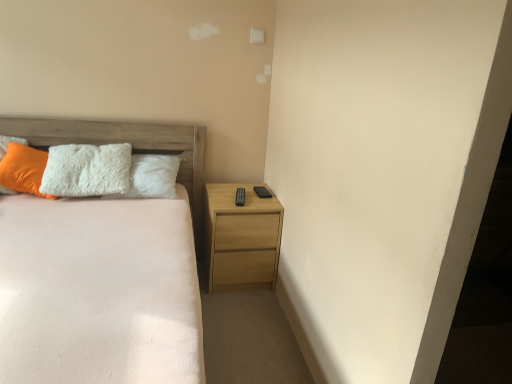
Where is `white fluffy bed at center`? The width and height of the screenshot is (512, 384). white fluffy bed at center is located at coordinates (106, 271).

This screenshot has width=512, height=384. What do you see at coordinates (242, 238) in the screenshot? I see `light wood/texture nightstand at right` at bounding box center [242, 238].

At what (x,y) coordinates should I click in order to perform the action: click on wooden headboard at upper left. Please return your answer as a coordinate pair (x, y). The image size is (512, 384). Looking at the image, I should click on (123, 142).

Which object is thinner, light wood/texture nightstand at right or wooden headboard at upper left?

Thinner between the two is wooden headboard at upper left.

What's the angular difference between light wood/texture nightstand at right and wooden headboard at upper left's facing directions?

light wood/texture nightstand at right and wooden headboard at upper left are facing 1.94 degrees away from each other.

Based on the photo, which is closer to the camera, (x=257, y=211) or (x=198, y=133)?

Point (x=257, y=211) is positioned closer to the camera compared to point (x=198, y=133).

Is light wood/texture nightstand at right facing away from wooden headboard at upper left?

That's not correct — light wood/texture nightstand at right is not looking away from wooden headboard at upper left.

Measure the distance between white fluffy bed at center and wooden headboard at upper left.

white fluffy bed at center is 30.61 inches away from wooden headboard at upper left.

Is white fluffy bed at center inside or outside of wooden headboard at upper left?

white fluffy bed at center is located beyond the bounds of wooden headboard at upper left.

Does white fluffy bed at center have a lesser width compared to wooden headboard at upper left?

In fact, white fluffy bed at center might be wider than wooden headboard at upper left.

Does point (148, 375) come behind point (2, 131)?

No, (148, 375) is closer to viewer.

From the image's perspective, is light wood/texture nightstand at right positioned above or below white fluffy bed at center?

light wood/texture nightstand at right is above white fluffy bed at center.

Looking at the image, does light wood/texture nightstand at right seem bigger or smaller compared to white fluffy bed at center?

In the image, light wood/texture nightstand at right appears to be smaller than white fluffy bed at center.

Considering the relative sizes of light wood/texture nightstand at right and white fluffy bed at center in the image provided, is light wood/texture nightstand at right thinner than white fluffy bed at center?

Yes, light wood/texture nightstand at right is thinner than white fluffy bed at center.

Does point (275, 272) lie behind point (13, 353)?

Yes, point (275, 272) is farther from viewer.

Does orange fuzzy pillow at left touch light wood/texture nightstand at right?

No, orange fuzzy pillow at left is not touching light wood/texture nightstand at right.

From the image's perspective, which one is positioned lower, orange fuzzy pillow at left or light wood/texture nightstand at right?

light wood/texture nightstand at right.

From a real-world perspective, which object stands above the other?

From a 3D spatial view, orange fuzzy pillow at left is above.

Which is in front, orange fuzzy pillow at left or white fluffy bed at center?

white fluffy bed at center is more forward.

Is orange fuzzy pillow at left to the right of white fluffy bed at center from the viewer's perspective?

No, orange fuzzy pillow at left is not to the right of white fluffy bed at center.

Between orange fuzzy pillow at left and white fluffy bed at center, which one has smaller width?

With smaller width is orange fuzzy pillow at left.

From the image's perspective, who appears lower, orange fuzzy pillow at left or white fluffy bed at center?

white fluffy bed at center.

Is orange fuzzy pillow at left at the back of white fluffy bed at center?

Yes, white fluffy bed at center is positioned with its back facing orange fuzzy pillow at left.

Based on the photo, between white fluffy bed at center and orange fuzzy pillow at left, which one has less height?

orange fuzzy pillow at left is shorter.

In the image, is white fluffy bed at center positioned in front of or behind orange fuzzy pillow at left?

Visually, white fluffy bed at center is located in front of orange fuzzy pillow at left.

In the scene shown: Which point is more distant from viewer, (128,308) or (13,148)?

Positioned behind is point (13,148).

Is orange fuzzy pillow at left facing away from wooden headboard at upper left?

No, orange fuzzy pillow at left is not facing away from wooden headboard at upper left.

Considering the relative sizes of orange fuzzy pillow at left and wooden headboard at upper left in the image provided, is orange fuzzy pillow at left taller than wooden headboard at upper left?

No.

From the image's perspective, is orange fuzzy pillow at left on top of wooden headboard at upper left?

Yes, from the image's perspective, orange fuzzy pillow at left is above wooden headboard at upper left.

Is orange fuzzy pillow at left bigger or smaller than wooden headboard at upper left?

Clearly, orange fuzzy pillow at left is smaller in size than wooden headboard at upper left.

At what (x,y) coordinates should I click in order to perform the action: click on nightstand below the wooden headboard at upper left (from the image's perspective). Please return your answer as a coordinate pair (x, y). Image resolution: width=512 pixels, height=384 pixels. Looking at the image, I should click on (242, 238).

You are a GUI agent. You are given a task and a screenshot of the screen. Output one action in this format:
    pyautogui.click(x=<x>, y=<y>)
    Task: Click on the headboard on the left of the white fluffy bed at center
    The image size is (512, 384).
    Given the screenshot: What is the action you would take?
    pyautogui.click(x=123, y=142)

Looking at the image, which one is located closer to light wood/texture nightstand at right, white fluffy bed at center or orange fuzzy pillow at left?

white fluffy bed at center is closer to light wood/texture nightstand at right.

Based on their spatial positions, is wooden headboard at upper left or white fluffy bed at center closer to light wood/texture nightstand at right?

Based on the image, wooden headboard at upper left appears to be nearer to light wood/texture nightstand at right.

Considering their positions, is light wood/texture nightstand at right positioned closer to wooden headboard at upper left than white fluffy bed at center?

light wood/texture nightstand at right lies closer to wooden headboard at upper left than the other object.

When comparing their distances from orange fuzzy pillow at left, does white fluffy bed at center or light wood/texture nightstand at right seem closer?

white fluffy bed at center.

Considering their positions, is white fluffy bed at center positioned closer to light wood/texture nightstand at right than wooden headboard at upper left?

wooden headboard at upper left.

Which object lies nearer to the anchor point white fluffy bed at center, wooden headboard at upper left or orange fuzzy pillow at left?

orange fuzzy pillow at left.

When comparing their distances from wooden headboard at upper left, does white fluffy bed at center or light wood/texture nightstand at right seem closer?

Among the two, light wood/texture nightstand at right is located nearer to wooden headboard at upper left.

Which object lies nearer to the anchor point wooden headboard at upper left, light wood/texture nightstand at right or orange fuzzy pillow at left?

The object closer to wooden headboard at upper left is orange fuzzy pillow at left.

The height and width of the screenshot is (384, 512). Identify the location of headboard between orange fuzzy pillow at left and light wood/texture nightstand at right from left to right. (123, 142).

The height and width of the screenshot is (384, 512). I want to click on pillow between white fluffy bed at center and light wood/texture nightstand at right in the front-back direction, so click(24, 169).

I want to click on headboard between white fluffy bed at center and light wood/texture nightstand at right along the z-axis, so click(x=123, y=142).

The width and height of the screenshot is (512, 384). I want to click on pillow between white fluffy bed at center and wooden headboard at upper left in the front-back direction, so click(24, 169).